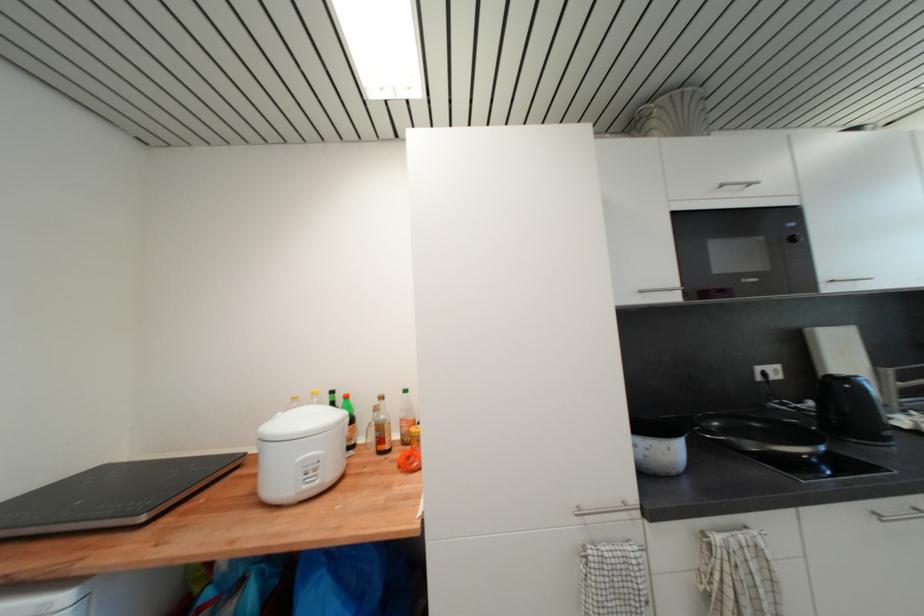
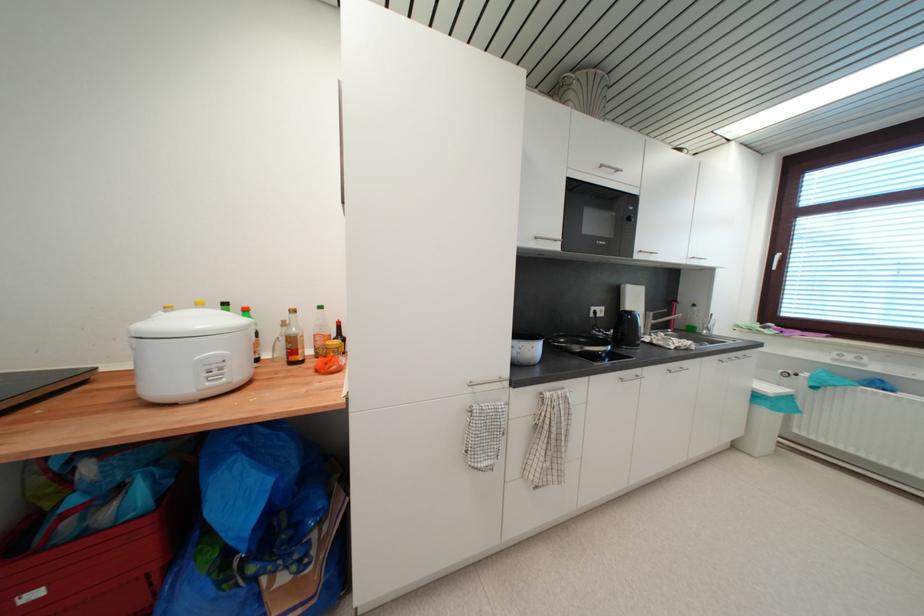
In the second image, find the point that corresponds to [321,472] in the first image.

(225, 371)